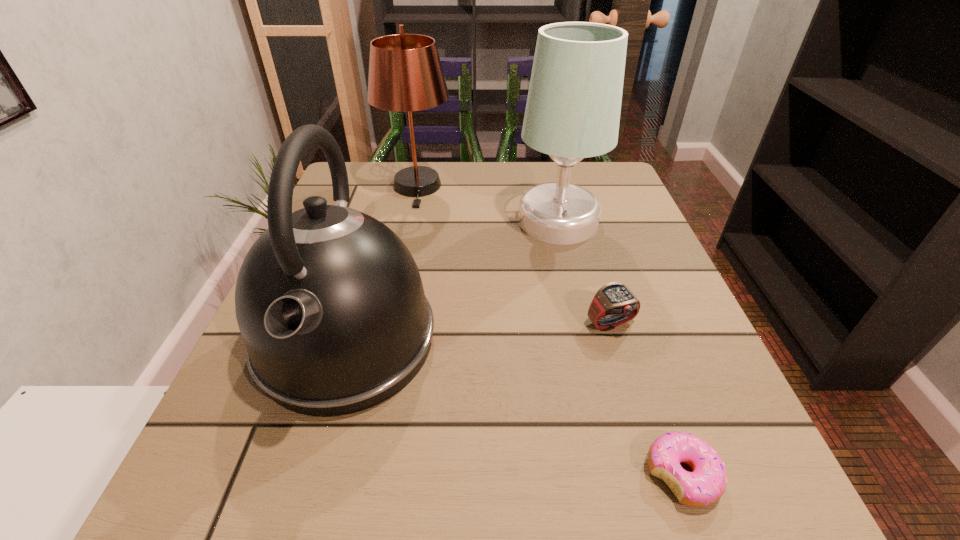
Locate an element on the screen. This screenshot has width=960, height=540. vacant space that satisfies the following two spatial constraints: 1. on the base of the right lampshade; 2. on the left side of the shortest object is located at coordinates (617, 475).

This screenshot has height=540, width=960. What are the coordinates of `vacant space that satisfies the following two spatial constraints: 1. on the base of the right lampshade; 2. on the spout of the kettle` in the screenshot? It's located at click(586, 340).

The image size is (960, 540). What are the coordinates of `vacant space that satisfies the following two spatial constraints: 1. on the base of the right lampshade; 2. on the left side of the doughnut` in the screenshot? It's located at (617, 475).

At what (x,y) coordinates should I click in order to perform the action: click on vacant region that satisfies the following two spatial constraints: 1. on the base of the right lampshade; 2. on the left side of the nearest object. Please return your answer as a coordinate pair (x, y). Looking at the image, I should click on (617, 475).

I want to click on free space that satisfies the following two spatial constraints: 1. on the back side of the watch; 2. on the base of the right lampshade, so click(x=580, y=221).

Image resolution: width=960 pixels, height=540 pixels. Find the location of `free location that satisfies the following two spatial constraints: 1. on the front-facing side of the nearest object; 2. on the right side of the left lampshade`. free location that satisfies the following two spatial constraints: 1. on the front-facing side of the nearest object; 2. on the right side of the left lampshade is located at coordinates (355, 475).

You are a GUI agent. You are given a task and a screenshot of the screen. Output one action in this format:
    pyautogui.click(x=<x>, y=<y>)
    Task: Click on the vacant space that satisfies the following two spatial constraints: 1. on the base of the right lampshade; 2. on the right side of the nearest object
    The height and width of the screenshot is (540, 960).
    Given the screenshot: What is the action you would take?
    point(617,475)

Locate an element on the screen. This screenshot has width=960, height=540. vacant region that satisfies the following two spatial constraints: 1. on the front-facing side of the fourth tallest object; 2. on the left side of the left lampshade is located at coordinates (388, 324).

This screenshot has height=540, width=960. Identify the location of free space that satisfies the following two spatial constraints: 1. on the front-facing side of the left lampshade; 2. on the left side of the nearest object. click(355, 475).